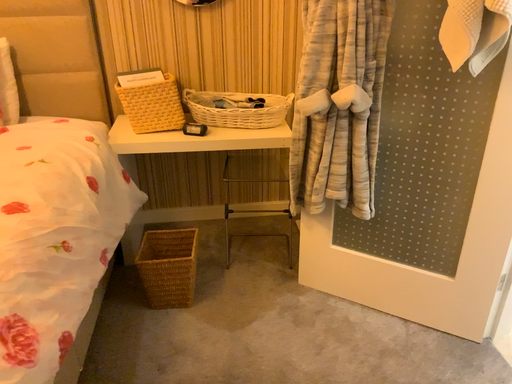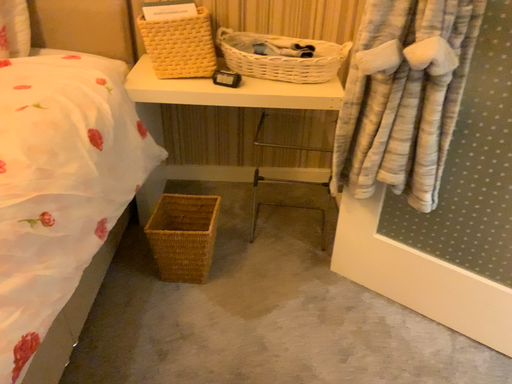
Question: Which way did the camera rotate in the video?

Choices:
 (A) rotated downward
 (B) rotated upward

Answer: (A)